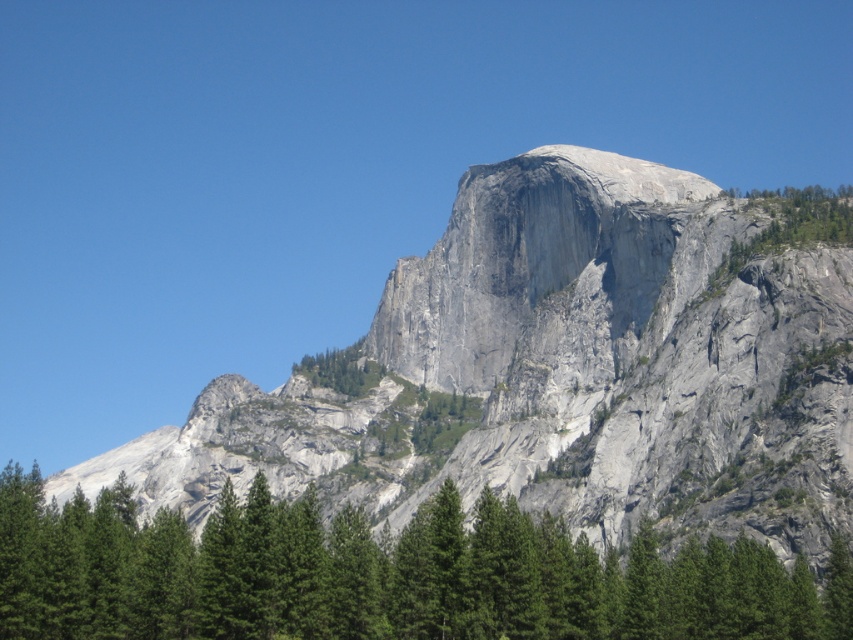
Which is more to the left, gray/granite peak at center or green leafy tree at center?

Positioned to the left is green leafy tree at center.

Is point (653, 166) closer to camera compared to point (358, 381)?

Yes.

Locate an element on the screen. This screenshot has height=640, width=853. gray/granite peak at center is located at coordinates (506, 259).

Is point (694, 570) positioned before point (358, 369)?

That is True.

Is green textured tree at center smaller than green leafy tree at center?

No, green textured tree at center is not smaller than green leafy tree at center.

Does point (254, 508) come behind point (299, 364)?

No, it is in front of (299, 364).

In order to click on green textured tree at center in this screenshot , I will do `click(381, 576)`.

Can you confirm if gray rock mountain at center is shorter than green textured tree at center?

In fact, gray rock mountain at center may be taller than green textured tree at center.

The height and width of the screenshot is (640, 853). Identify the location of gray rock mountain at center. (566, 369).

Locate an element on the screen. Image resolution: width=853 pixels, height=640 pixels. gray rock mountain at center is located at coordinates (566, 369).